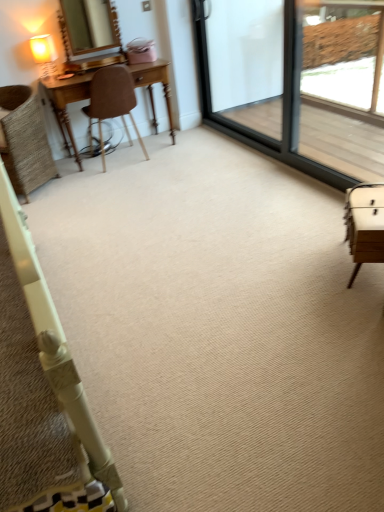
At what (x,y) coordinates should I click in order to perform the action: click on unoccupied region to the right of matte cream table lamp at upper left. Please return your answer as a coordinate pair (x, y). Looking at the image, I should click on (76, 74).